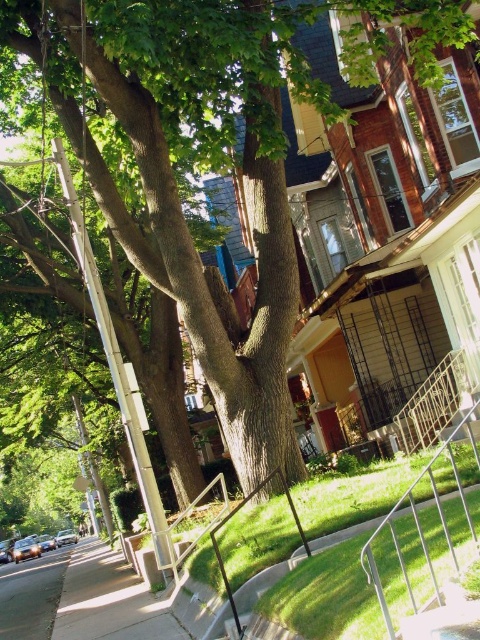
Question: Which object appears farthest from the camera in this image?

Choices:
 (A) smooth concrete sidewalk at lower left
 (B) silver metallic car at lower left
 (C) green grass at lower right
 (D) smooth asphalt pavement at lower left

Answer: (B)

Question: Observing the image, what is the correct spatial positioning of smooth asphalt pavement at lower left in reference to silver metallic car at lower left?

Choices:
 (A) left
 (B) right

Answer: (B)

Question: Which point is farther from the camera taking this photo?

Choices:
 (A) (74, 532)
 (B) (68, 602)

Answer: (A)

Question: Which point is closer to the camera?

Choices:
 (A) pyautogui.click(x=88, y=556)
 (B) pyautogui.click(x=336, y=544)
 (C) pyautogui.click(x=31, y=547)

Answer: (B)

Question: Is green grass at lower right positioned behind silver metallic car at lower left?

Choices:
 (A) no
 (B) yes

Answer: (A)

Question: Does smooth asphalt pavement at lower left appear over green grass at lower right?

Choices:
 (A) yes
 (B) no

Answer: (B)